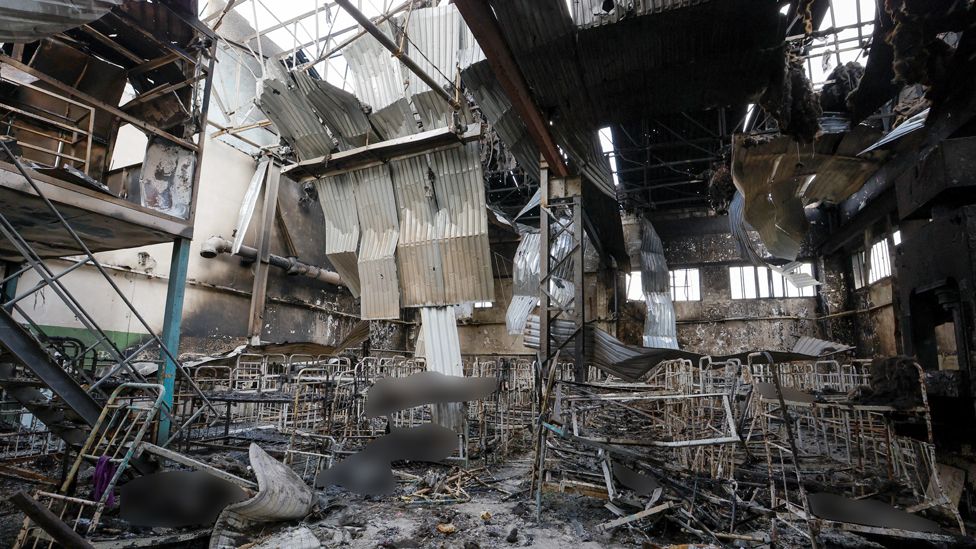
Image resolution: width=976 pixels, height=549 pixels. Find the location of `rust colored cieling support beam`. rust colored cieling support beam is located at coordinates (521, 95).